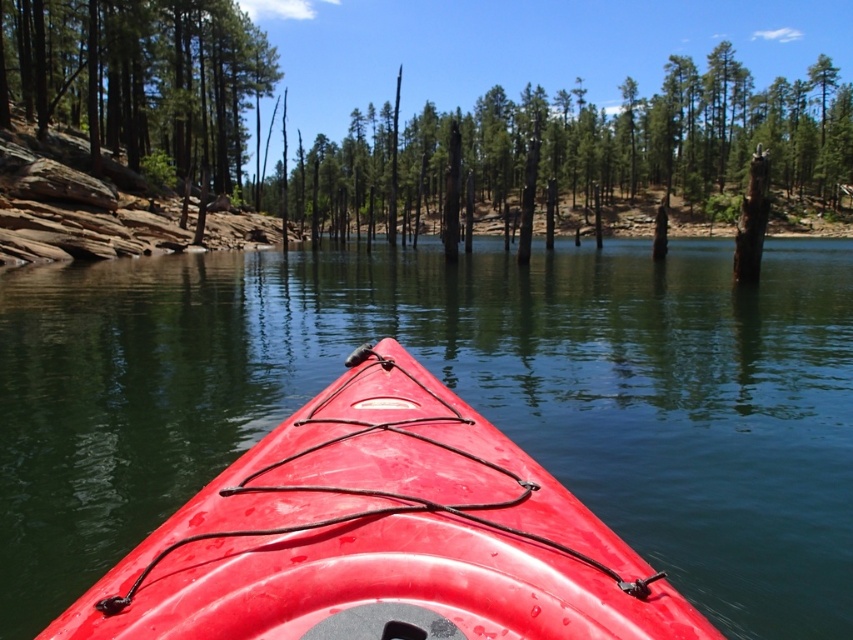
You are planning to cross the water in the glossy plastic kayak at center. There is a narrow passage between two obstacles. The smooth brown log at left is one of them. Based on their widths, can the kayak fit through the passage if the log is on one side?

The glossy plastic kayak at center has a lesser width compared to the smooth brown log at left, so the kayak can fit through the passage as it is narrower than the log.

You are in a red kayak and need to navigate between the dead wood stump at center and the smooth brown log at left. Which object should you steer around to avoid collision?

You should steer around the dead wood stump at center because it is positioned over the smooth brown log at left, meaning it is closer to your kayak and directly in your path.

You are in a boat and need to know if you can safely pass under a bridge. The glossy plastic kayak at center and the smooth brown log at left are in your path. Which object is shorter and therefore allows easier passage under it?

The glossy plastic kayak at center is not as tall as the smooth brown log at left, so it is shorter and allows easier passage under it.